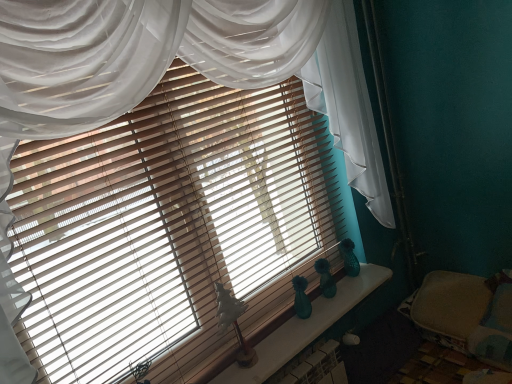
Image resolution: width=512 pixels, height=384 pixels. Describe the element at coordinates (467, 314) in the screenshot. I see `beige fabric bed at lower right` at that location.

Image resolution: width=512 pixels, height=384 pixels. I want to click on beige fabric bed at lower right, so click(x=467, y=314).

What is the approximate height of teal glass vases at center?

It is 2.97 inches.

This screenshot has width=512, height=384. Describe the element at coordinates (295, 330) in the screenshot. I see `teal glass vases at center` at that location.

The width and height of the screenshot is (512, 384). I want to click on teal glass vases at center, so click(295, 330).

Where is `beige fabric bed at lower right`? The height and width of the screenshot is (384, 512). beige fabric bed at lower right is located at coordinates (467, 314).

Considering the relative positions of teal glass vases at center and beige fabric bed at lower right in the image provided, is teal glass vases at center to the right of beige fabric bed at lower right from the viewer's perspective?

In fact, teal glass vases at center is to the left of beige fabric bed at lower right.

Considering the relative positions of teal glass vases at center and beige fabric bed at lower right in the image provided, is teal glass vases at center behind beige fabric bed at lower right?

No, the depth of teal glass vases at center is less than that of beige fabric bed at lower right.

Which is behind, point (357, 277) or point (455, 337)?

Positioned behind is point (357, 277).

From the image's perspective, would you say teal glass vases at center is shown under beige fabric bed at lower right?

Correct, teal glass vases at center appears lower than beige fabric bed at lower right in the image.

From a real-world perspective, is teal glass vases at center under beige fabric bed at lower right?

No.

Considering the sizes of objects teal glass vases at center and beige fabric bed at lower right in the image provided, who is thinner, teal glass vases at center or beige fabric bed at lower right?

Thinner between the two is teal glass vases at center.

Is teal glass vases at center shorter than beige fabric bed at lower right?

Yes.

Is teal glass vases at center bigger or smaller than beige fabric bed at lower right?

In the image, teal glass vases at center appears to be smaller than beige fabric bed at lower right.

Which is correct: teal glass vases at center is inside beige fabric bed at lower right, or outside of it?

teal glass vases at center is outside beige fabric bed at lower right.

Is teal glass vases at center positioned far away from beige fabric bed at lower right?

No, teal glass vases at center is in close proximity to beige fabric bed at lower right.

Is teal glass vases at center looking in the opposite direction of beige fabric bed at lower right?

That's not correct — teal glass vases at center is not looking away from beige fabric bed at lower right.

How distant is teal glass vases at center from beige fabric bed at lower right?

teal glass vases at center and beige fabric bed at lower right are 17.79 inches apart from each other.

Where is `window sill in front of the beige fabric bed at lower right`? window sill in front of the beige fabric bed at lower right is located at coordinates (295, 330).

Considering the relative positions of beige fabric bed at lower right and teal glass vases at center in the image provided, is beige fabric bed at lower right to the right of teal glass vases at center from the viewer's perspective?

Indeed, beige fabric bed at lower right is positioned on the right side of teal glass vases at center.

Which object is more forward, beige fabric bed at lower right or teal glass vases at center?

teal glass vases at center is closer to the camera.

Considering the positions of point (498, 352) and point (251, 370), is point (498, 352) closer or farther from the camera than point (251, 370)?

Point (498, 352) is positioned farther from the camera compared to point (251, 370).

From the image's perspective, would you say beige fabric bed at lower right is shown under teal glass vases at center?

No, from the image's perspective, beige fabric bed at lower right is not beneath teal glass vases at center.

From a real-world perspective, who is located higher, beige fabric bed at lower right or teal glass vases at center?

teal glass vases at center.

Considering the sizes of objects beige fabric bed at lower right and teal glass vases at center in the image provided, who is wider, beige fabric bed at lower right or teal glass vases at center?

beige fabric bed at lower right.

Which of these two, beige fabric bed at lower right or teal glass vases at center, stands taller?

beige fabric bed at lower right.

Is beige fabric bed at lower right bigger or smaller than teal glass vases at center?

In the image, beige fabric bed at lower right appears to be larger than teal glass vases at center.

Is beige fabric bed at lower right inside the boundaries of teal glass vases at center, or outside?

beige fabric bed at lower right is spatially situated outside teal glass vases at center.

Is the surface of beige fabric bed at lower right in direct contact with teal glass vases at center?

beige fabric bed at lower right is not next to teal glass vases at center, and they're not touching.

Is beige fabric bed at lower right oriented towards teal glass vases at center?

Yes, beige fabric bed at lower right is turned towards teal glass vases at center.

What's the angular difference between beige fabric bed at lower right and teal glass vases at center's facing directions?

They differ by 91 degrees in their facing directions.

Measure the distance from beige fabric bed at lower right to teal glass vases at center.

The distance of beige fabric bed at lower right from teal glass vases at center is 17.79 inches.

This screenshot has width=512, height=384. Find the location of `bed located behind the teal glass vases at center`. bed located behind the teal glass vases at center is located at coordinates (467, 314).

The height and width of the screenshot is (384, 512). Find the location of `window sill on the left of beige fabric bed at lower right`. window sill on the left of beige fabric bed at lower right is located at coordinates (295, 330).

Find the location of `window sill above the beige fabric bed at lower right (from a real-world perspective)`. window sill above the beige fabric bed at lower right (from a real-world perspective) is located at coordinates (295, 330).